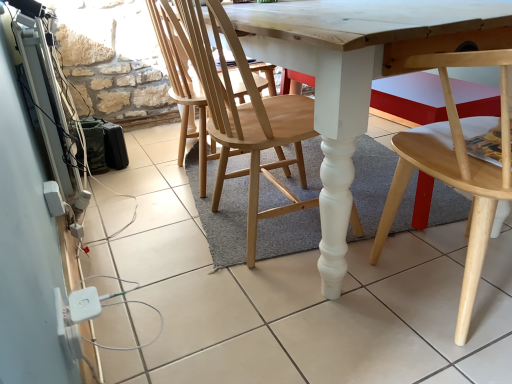
Identify the location of natural wood chair at center, the 2th chair when ordered from right to left. This screenshot has width=512, height=384. (243, 113).

Describe the element at coordinates (243, 113) in the screenshot. Image resolution: width=512 pixels, height=384 pixels. I see `natural wood chair at center, marked as the 1th chair in a left-to-right arrangement` at that location.

What do you see at coordinates (454, 171) in the screenshot? The width and height of the screenshot is (512, 384). I see `light wood chair at lower right, the first chair in the right-to-left sequence` at bounding box center [454, 171].

Where is `light wood chair at lower right, the first chair in the right-to-left sequence`? light wood chair at lower right, the first chair in the right-to-left sequence is located at coordinates (x=454, y=171).

You are a GUI agent. You are given a task and a screenshot of the screen. Output one action in this format:
    pyautogui.click(x=<x>, y=<y>)
    Task: Click on the natural wood chair at center, marked as the 1th chair in a left-to-right arrangement
    This screenshot has width=512, height=384.
    Given the screenshot: What is the action you would take?
    pyautogui.click(x=243, y=113)

Considering the relative positions of natural wood chair at center, the 2th chair when ordered from right to left, and light wood chair at lower right, which is the second chair in left-to-right order, in the image provided, is natural wood chair at center, the 2th chair when ordered from right to left, to the left or to the right of light wood chair at lower right, which is the second chair in left-to-right order,?

natural wood chair at center, the 2th chair when ordered from right to left, is to the left of light wood chair at lower right, which is the second chair in left-to-right order.

Is natural wood chair at center, marked as the 1th chair in a left-to-right arrangement, positioned before light wood chair at lower right, the first chair in the right-to-left sequence?

No, natural wood chair at center, marked as the 1th chair in a left-to-right arrangement, is further to the viewer.

Which point is more distant from viewer, [234,52] or [483,222]?

The point [234,52] is more distant.

From the image's perspective, between natural wood chair at center, marked as the 1th chair in a left-to-right arrangement, and light wood chair at lower right, the first chair in the right-to-left sequence, who is located below?

From the image's view, light wood chair at lower right, the first chair in the right-to-left sequence, is below.

Consider the image. From a real-world perspective, is natural wood chair at center, the 2th chair when ordered from right to left, physically above light wood chair at lower right, which is the second chair in left-to-right order?

Indeed, from a real-world perspective, natural wood chair at center, the 2th chair when ordered from right to left, stands above light wood chair at lower right, which is the second chair in left-to-right order.

Considering the sizes of objects natural wood chair at center, the 2th chair when ordered from right to left, and light wood chair at lower right, the first chair in the right-to-left sequence, in the image provided, who is thinner, natural wood chair at center, the 2th chair when ordered from right to left, or light wood chair at lower right, the first chair in the right-to-left sequence,?

Thinner between the two is natural wood chair at center, the 2th chair when ordered from right to left.

Can you confirm if natural wood chair at center, the 2th chair when ordered from right to left, is shorter than light wood chair at lower right, which is the second chair in left-to-right order?

In fact, natural wood chair at center, the 2th chair when ordered from right to left, may be taller than light wood chair at lower right, which is the second chair in left-to-right order.

Considering the sizes of objects natural wood chair at center, marked as the 1th chair in a left-to-right arrangement, and light wood chair at lower right, the first chair in the right-to-left sequence, in the image provided, who is bigger, natural wood chair at center, marked as the 1th chair in a left-to-right arrangement, or light wood chair at lower right, the first chair in the right-to-left sequence,?

Bigger between the two is light wood chair at lower right, the first chair in the right-to-left sequence.

Do you think natural wood chair at center, the 2th chair when ordered from right to left, is within light wood chair at lower right, which is the second chair in left-to-right order, or outside of it?

natural wood chair at center, the 2th chair when ordered from right to left, is spatially situated outside light wood chair at lower right, which is the second chair in left-to-right order.

Is natural wood chair at center, marked as the 1th chair in a left-to-right arrangement, next to light wood chair at lower right, the first chair in the right-to-left sequence, and touching it?

No.

Is natural wood chair at center, marked as the 1th chair in a left-to-right arrangement, oriented towards light wood chair at lower right, which is the second chair in left-to-right order?

No, natural wood chair at center, marked as the 1th chair in a left-to-right arrangement, is not oriented towards light wood chair at lower right, which is the second chair in left-to-right order.

Could you measure the distance between natural wood chair at center, the 2th chair when ordered from right to left, and light wood chair at lower right, which is the second chair in left-to-right order?

natural wood chair at center, the 2th chair when ordered from right to left, and light wood chair at lower right, which is the second chair in left-to-right order, are 19.96 inches apart from each other.

You are a GUI agent. You are given a task and a screenshot of the screen. Output one action in this format:
    pyautogui.click(x=<x>, y=<y>)
    Task: Click on the chair on the right of natural wood chair at center, marked as the 1th chair in a left-to-right arrangement
    This screenshot has height=384, width=512.
    Given the screenshot: What is the action you would take?
    pyautogui.click(x=454, y=171)

Considering the relative positions of light wood chair at lower right, the first chair in the right-to-left sequence, and natural wood chair at center, marked as the 1th chair in a left-to-right arrangement, in the image provided, is light wood chair at lower right, the first chair in the right-to-left sequence, to the left or to the right of natural wood chair at center, marked as the 1th chair in a left-to-right arrangement,?

light wood chair at lower right, the first chair in the right-to-left sequence, is to the right of natural wood chair at center, marked as the 1th chair in a left-to-right arrangement.

Is the position of light wood chair at lower right, the first chair in the right-to-left sequence, more distant than that of natural wood chair at center, the 2th chair when ordered from right to left?

No.

Between point (485, 169) and point (190, 12), which one is positioned behind?

Point (190, 12)

Consider the image. From the image's perspective, is light wood chair at lower right, the first chair in the right-to-left sequence, located above natural wood chair at center, the 2th chair when ordered from right to left?

Actually, light wood chair at lower right, the first chair in the right-to-left sequence, appears below natural wood chair at center, the 2th chair when ordered from right to left, in the image.

From a real-world perspective, relative to natural wood chair at center, marked as the 1th chair in a left-to-right arrangement, is light wood chair at lower right, which is the second chair in left-to-right order, vertically above or below?

From a real-world perspective, light wood chair at lower right, which is the second chair in left-to-right order, is physically below natural wood chair at center, marked as the 1th chair in a left-to-right arrangement.

From the picture: Does light wood chair at lower right, which is the second chair in left-to-right order, have a lesser width compared to natural wood chair at center, marked as the 1th chair in a left-to-right arrangement?

No.

Considering the sizes of objects light wood chair at lower right, which is the second chair in left-to-right order, and natural wood chair at center, the 2th chair when ordered from right to left, in the image provided, who is taller, light wood chair at lower right, which is the second chair in left-to-right order, or natural wood chair at center, the 2th chair when ordered from right to left,?

Standing taller between the two is natural wood chair at center, the 2th chair when ordered from right to left.

Who is smaller, light wood chair at lower right, the first chair in the right-to-left sequence, or natural wood chair at center, the 2th chair when ordered from right to left?

natural wood chair at center, the 2th chair when ordered from right to left.

Is light wood chair at lower right, which is the second chair in left-to-right order, located outside natural wood chair at center, the 2th chair when ordered from right to left?

Absolutely, light wood chair at lower right, which is the second chair in left-to-right order, is external to natural wood chair at center, the 2th chair when ordered from right to left.

Is light wood chair at lower right, the first chair in the right-to-left sequence, not close to natural wood chair at center, marked as the 1th chair in a left-to-right arrangement?

No, light wood chair at lower right, the first chair in the right-to-left sequence, is not far away from natural wood chair at center, marked as the 1th chair in a left-to-right arrangement.

Is light wood chair at lower right, the first chair in the right-to-left sequence, oriented away from natural wood chair at center, the 2th chair when ordered from right to left?

Absolutely, light wood chair at lower right, the first chair in the right-to-left sequence, is directed away from natural wood chair at center, the 2th chair when ordered from right to left.

Can you tell me how much light wood chair at lower right, which is the second chair in left-to-right order, and natural wood chair at center, marked as the 1th chair in a left-to-right arrangement, differ in facing direction?

90 degrees separate the facing orientations of light wood chair at lower right, which is the second chair in left-to-right order, and natural wood chair at center, marked as the 1th chair in a left-to-right arrangement.

This screenshot has height=384, width=512. Identify the location of chair located on the left of light wood chair at lower right, the first chair in the right-to-left sequence. (243, 113).

This screenshot has width=512, height=384. Identify the location of chair above the light wood chair at lower right, the first chair in the right-to-left sequence (from the image's perspective). (243, 113).

Where is `chair behind the light wood chair at lower right, which is the second chair in left-to-right order`? The width and height of the screenshot is (512, 384). chair behind the light wood chair at lower right, which is the second chair in left-to-right order is located at coordinates (243, 113).